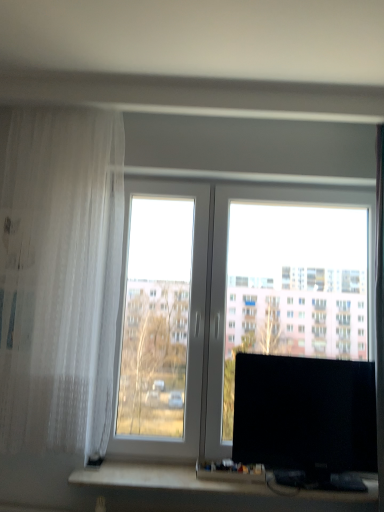
Question: Is white sheer curtain at left to the right of transparent glass window at center from the viewer's perspective?

Choices:
 (A) yes
 (B) no

Answer: (B)

Question: Is white sheer curtain at left taller than transparent glass window at center?

Choices:
 (A) yes
 (B) no

Answer: (A)

Question: Can you confirm if white sheer curtain at left is positioned to the left of transparent glass window at center?

Choices:
 (A) yes
 (B) no

Answer: (A)

Question: Is white sheer curtain at left located outside transparent glass window at center?

Choices:
 (A) no
 (B) yes

Answer: (B)

Question: Is white sheer curtain at left smaller than transparent glass window at center?

Choices:
 (A) no
 (B) yes

Answer: (A)

Question: Is white sheer curtain at left bigger than transparent glass window at center?

Choices:
 (A) yes
 (B) no

Answer: (A)

Question: Considering the relative sizes of transparent glass window at center and white sheer curtain at left in the image provided, is transparent glass window at center thinner than white sheer curtain at left?

Choices:
 (A) yes
 (B) no

Answer: (A)

Question: From a real-world perspective, is transparent glass window at center under white sheer curtain at left?

Choices:
 (A) no
 (B) yes

Answer: (B)

Question: Is transparent glass window at center taller than white sheer curtain at left?

Choices:
 (A) no
 (B) yes

Answer: (A)

Question: Is transparent glass window at center outside of white sheer curtain at left?

Choices:
 (A) yes
 (B) no

Answer: (A)

Question: Does transparent glass window at center have a greater width compared to white sheer curtain at left?

Choices:
 (A) yes
 (B) no

Answer: (B)

Question: From the image's perspective, is transparent glass window at center below white sheer curtain at left?

Choices:
 (A) yes
 (B) no

Answer: (A)

Question: Considering the relative sizes of white sheer curtain at left and black glossy monitor at right in the image provided, is white sheer curtain at left thinner than black glossy monitor at right?

Choices:
 (A) no
 (B) yes

Answer: (A)